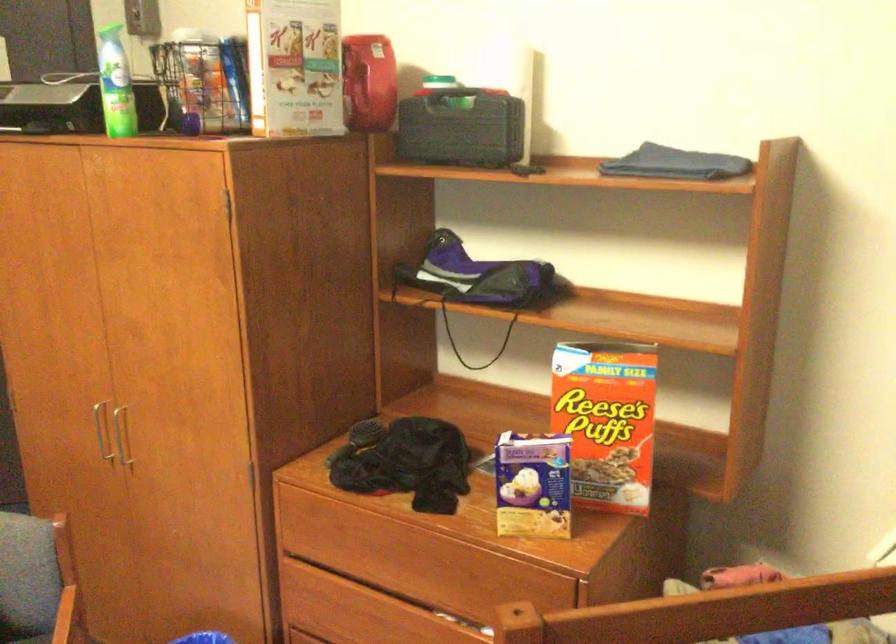
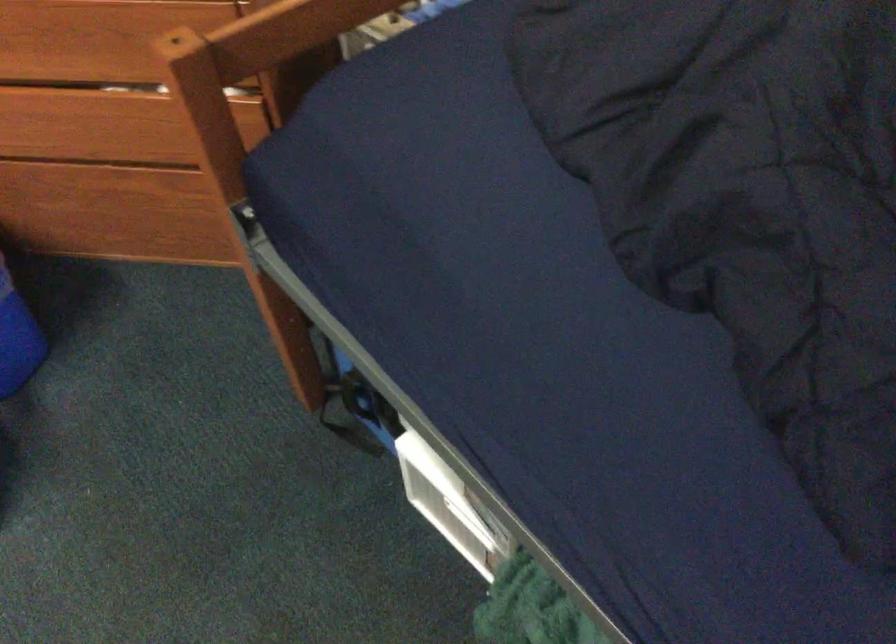
First-person continuous shooting, in which direction is the camera rotating?

The rotation direction of the camera is right-down.